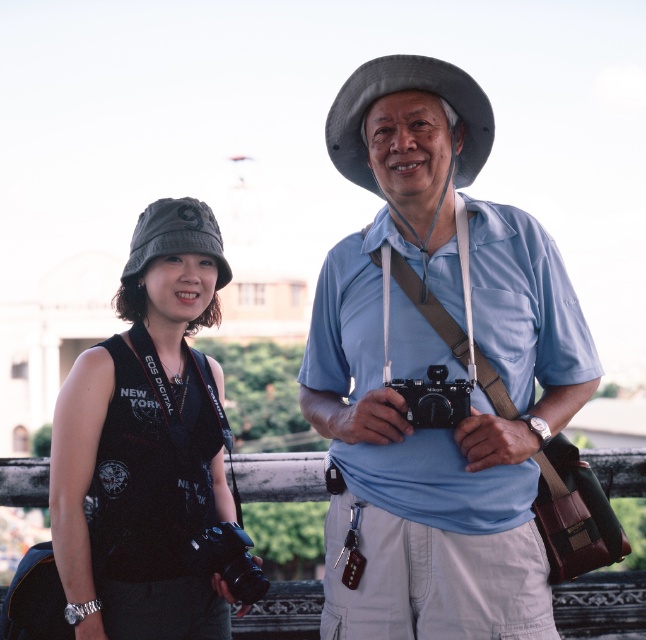
Question: Is matte blue shirt at center above black fabric hat at left?

Choices:
 (A) yes
 (B) no

Answer: (B)

Question: Which object appears farthest from the camera in this image?

Choices:
 (A) black fabric hat at left
 (B) black fabric tank top at left
 (C) matte blue shirt at center
 (D) gray fabric cowboy hat at center

Answer: (A)

Question: From the image, what is the correct spatial relationship of matte blue shirt at center in relation to black fabric tank top at left?

Choices:
 (A) left
 (B) right

Answer: (B)

Question: Which object is the closest to the black fabric tank top at left?

Choices:
 (A) matte blue shirt at center
 (B) gray fabric cowboy hat at center

Answer: (A)

Question: Can you confirm if gray fabric cowboy hat at center is smaller than black plastic camera at lower left?

Choices:
 (A) yes
 (B) no

Answer: (B)

Question: Based on their relative distances, which object is nearer to the black plastic camera at center?

Choices:
 (A) black plastic camera at lower left
 (B) matte blue shirt at center

Answer: (B)